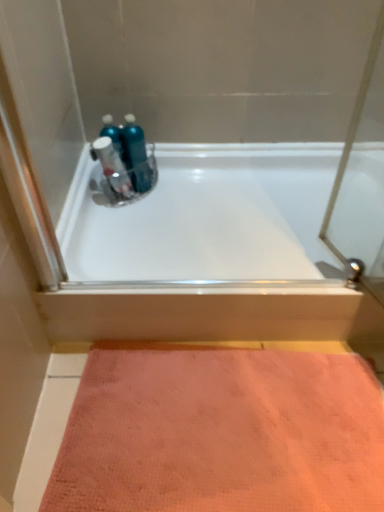
Where is `vacant area that is situated to the right of metallic blue spray bottle at upper center`? This screenshot has height=512, width=384. vacant area that is situated to the right of metallic blue spray bottle at upper center is located at coordinates (174, 197).